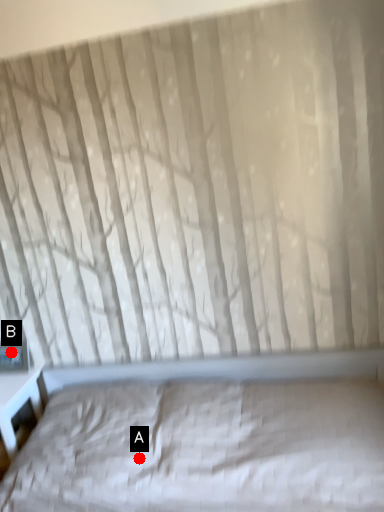
Question: Two points are circled on the image, labeled by A and B beside each circle. Among these points, which one is nearest to the camera?

Choices:
 (A) A is closer
 (B) B is closer

Answer: (A)